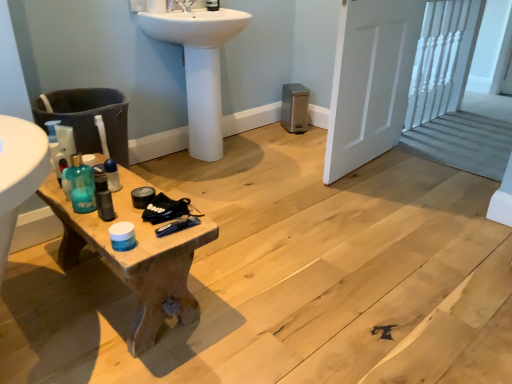
Where is `vacant position to the left of white wooden door at right`? This screenshot has width=512, height=384. vacant position to the left of white wooden door at right is located at coordinates (283, 161).